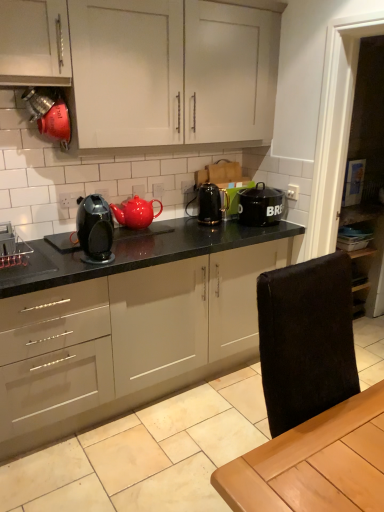
Question: Can you confirm if matte black coffee maker at center is positioned to the left of brushed metal spice rack at left, which is counted as the first appliance, starting from the front?

Choices:
 (A) no
 (B) yes

Answer: (A)

Question: From the image's perspective, is matte black coffee maker at center beneath brushed metal spice rack at left, the second appliance from the top?

Choices:
 (A) yes
 (B) no

Answer: (B)

Question: Is matte black coffee maker at center turned away from brushed metal spice rack at left, which ranks as the first appliance in left-to-right order?

Choices:
 (A) no
 (B) yes

Answer: (A)

Question: From the image's perspective, would you say matte black coffee maker at center is positioned over brushed metal spice rack at left, which is counted as the first appliance, starting from the front?

Choices:
 (A) no
 (B) yes

Answer: (B)

Question: Does matte black coffee maker at center have a greater width compared to brushed metal spice rack at left, which is counted as the first appliance, starting from the front?

Choices:
 (A) yes
 (B) no

Answer: (B)

Question: Considering the positions of point click(x=3, y=251) and point click(x=201, y=215), is point click(x=3, y=251) closer or farther from the camera than point click(x=201, y=215)?

Choices:
 (A) closer
 (B) farther

Answer: (A)

Question: In terms of size, does brushed metal spice rack at left, marked as the 2th appliance in a back-to-front arrangement, appear bigger or smaller than black glossy electric kettle at center, which is the second appliance from left to right?

Choices:
 (A) small
 (B) big

Answer: (A)

Question: From a real-world perspective, is brushed metal spice rack at left, which is counted as the first appliance, starting from the front, physically located above or below black glossy electric kettle at center, the 2th appliance when ordered from bottom to top?

Choices:
 (A) above
 (B) below

Answer: (B)

Question: In the image, is brushed metal spice rack at left, marked as the second appliance in a right-to-left arrangement, on the left side or the right side of black glossy electric kettle at center, marked as the first appliance in a back-to-front arrangement?

Choices:
 (A) left
 (B) right

Answer: (A)

Question: Based on their sizes in the image, would you say white matte cabinet at upper center is bigger or smaller than black granite countertop at center?

Choices:
 (A) small
 (B) big

Answer: (A)

Question: From the image's perspective, is white matte cabinet at upper center positioned above or below black granite countertop at center?

Choices:
 (A) below
 (B) above

Answer: (B)

Question: Would you say white matte cabinet at upper center is to the left or to the right of black granite countertop at center in the picture?

Choices:
 (A) right
 (B) left

Answer: (A)

Question: Is white matte cabinet at upper center inside the boundaries of black granite countertop at center, or outside?

Choices:
 (A) outside
 (B) inside

Answer: (A)

Question: From a real-world perspective, relative to matte black coffee maker at center, is brushed metal spice rack at left, which ranks as the 1th appliance in bottom-to-top order, vertically above or below?

Choices:
 (A) below
 (B) above

Answer: (A)

Question: From the image's perspective, is brushed metal spice rack at left, marked as the second appliance in a right-to-left arrangement, located above or below matte black coffee maker at center?

Choices:
 (A) above
 (B) below

Answer: (B)